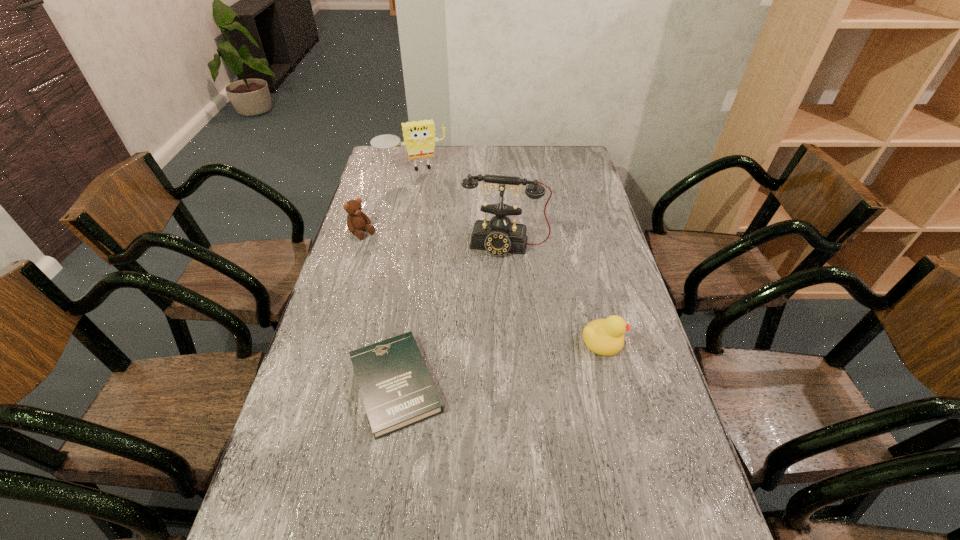
Identify the location of vacant space that's between the shortest object and the rightmost object. (499, 363).

This screenshot has width=960, height=540. I want to click on free area in between the third tallest object and the rightmost object, so click(x=483, y=287).

Find the location of a particular element. This screenshot has width=960, height=540. empty space that is in between the fourth object from left to right and the book is located at coordinates (450, 315).

Locate an element on the screen. This screenshot has height=540, width=960. vacant area between the book and the telephone is located at coordinates (450, 315).

Locate an element on the screen. The height and width of the screenshot is (540, 960). vacant space in between the tallest object and the third shortest object is located at coordinates (434, 239).

Where is `empty location between the teddy bear and the telephone`? empty location between the teddy bear and the telephone is located at coordinates (434, 239).

In order to click on free space between the third tallest object and the telephone in this screenshot , I will do `click(434, 239)`.

You are a GUI agent. You are given a task and a screenshot of the screen. Output one action in this format:
    pyautogui.click(x=<x>, y=<y>)
    Task: Click on the unoccupied position between the book and the rightmost object
    
    Given the screenshot: What is the action you would take?
    pyautogui.click(x=499, y=363)

Locate which object ranks in proximity to the teddy bear. Please provide its 2D coordinates. Your answer should be formatted as a tuple, i.e. [(x, y)], where the tuple contains the x and y coordinates of a point satisfying the conditions above.

[(499, 236)]

Locate an element on the screen. The image size is (960, 540). object identified as the fourth closest to the fourth object from left to right is located at coordinates (419, 137).